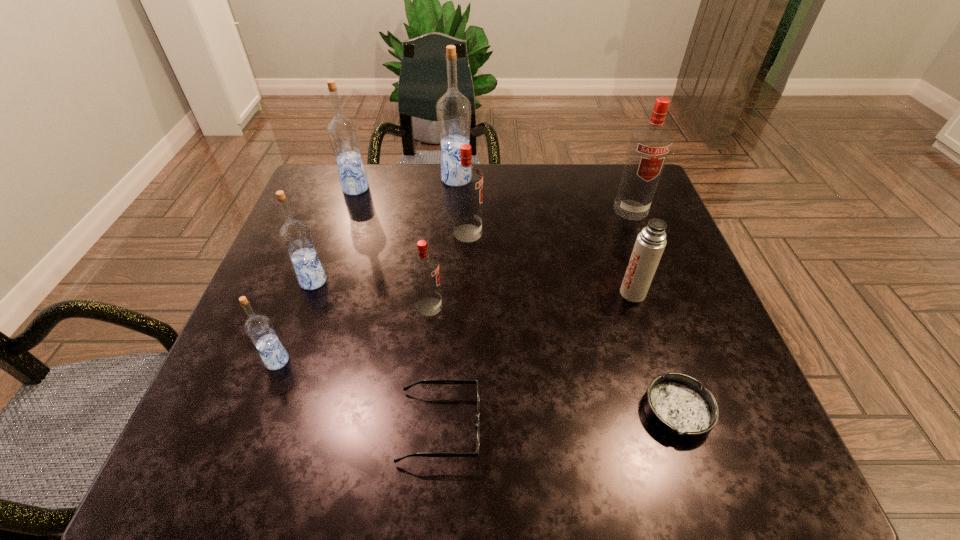
The height and width of the screenshot is (540, 960). I want to click on object that stands as the third closest to the leftmost red vodka, so click(x=295, y=235).

This screenshot has width=960, height=540. I want to click on vodka that is the second closest to the second biggest red vodka, so click(424, 266).

You are a GUI agent. You are given a task and a screenshot of the screen. Output one action in this format:
    pyautogui.click(x=<x>, y=<y>)
    Task: Click on the vodka that stands as the closest to the third smallest blue vodka
    
    Given the screenshot: What is the action you would take?
    pyautogui.click(x=453, y=110)

Locate an element on the screen. The image size is (960, 540). blue vodka that stands as the third closest to the third nearest object is located at coordinates [453, 110].

Locate an element on the screen. blue vodka that stands as the fourth closest to the dark ashtray is located at coordinates tap(342, 132).

Where is `red vodka that stands as the third closest to the black sunglasses`? This screenshot has height=540, width=960. red vodka that stands as the third closest to the black sunglasses is located at coordinates (650, 144).

Where is `red vodka that is the third nearest to the rightmost blue vodka`? red vodka that is the third nearest to the rightmost blue vodka is located at coordinates (424, 266).

Where is `free space in the image that satisfies the following two spatial constraints: 1. on the front label of the fifth nearest vodka; 2. on the front label of the second nearest vodka`? The width and height of the screenshot is (960, 540). free space in the image that satisfies the following two spatial constraints: 1. on the front label of the fifth nearest vodka; 2. on the front label of the second nearest vodka is located at coordinates (668, 307).

Identify the location of free space that satisfies the following two spatial constraints: 1. on the front label of the third farthest object; 2. at the front lenses of the ninth tallest object. (714, 427).

You are a GUI agent. You are given a task and a screenshot of the screen. Output one action in this format:
    pyautogui.click(x=<x>, y=<y>)
    Task: Click on the free spot that satisfies the following two spatial constraints: 1. on the front label of the fifth nearest vodka; 2. on the front label of the second red vodka from left to right
    This screenshot has width=960, height=540.
    Given the screenshot: What is the action you would take?
    pyautogui.click(x=639, y=233)